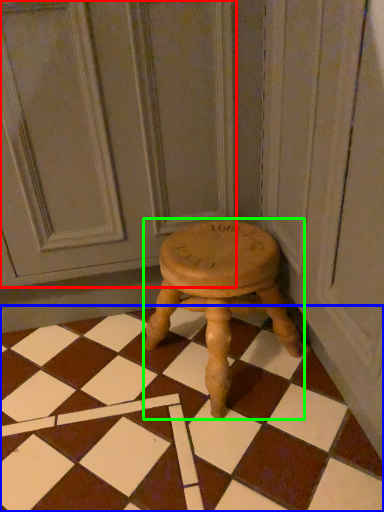
Question: Which object is positioned farthest from screen door (highlighted by a red box)? Select from square (highlighted by a blue box) and stool (highlighted by a green box).

Choices:
 (A) square
 (B) stool

Answer: (A)